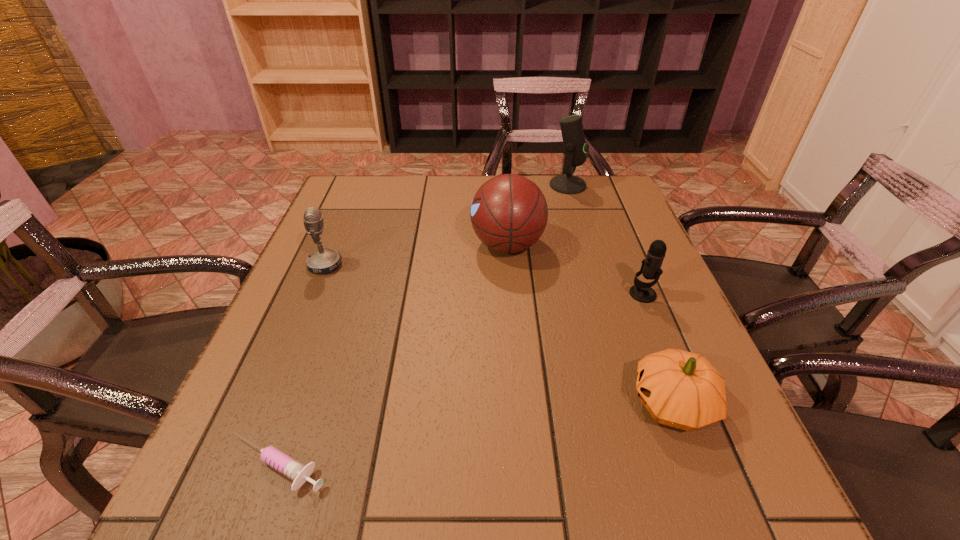
Identify the location of blank space located 0.290m on the front-facing side of the second nearest microphone. This screenshot has height=540, width=960. (464, 265).

Where is `vacant space located on the left of the nearest microphone`? Image resolution: width=960 pixels, height=540 pixels. vacant space located on the left of the nearest microphone is located at coordinates (467, 294).

What are the coordinates of `vacant point located 0.260m on the side of the gourd with the carved face` in the screenshot? It's located at (481, 403).

Locate an element on the screen. vacant region located 0.260m on the side of the gourd with the carved face is located at coordinates (481, 403).

Find the location of a particular element. The image size is (960, 540). free space located on the side of the gourd with the carved face is located at coordinates (406, 403).

The image size is (960, 540). I want to click on vacant position located 0.240m on the back of the syringe, so click(326, 329).

I want to click on object present at the far edge, so click(x=575, y=148).

Where is `object that is at the near edge`? The height and width of the screenshot is (540, 960). object that is at the near edge is located at coordinates (297, 472).

I want to click on microphone at the left edge, so click(324, 260).

I want to click on syringe at the left edge, so click(x=297, y=472).